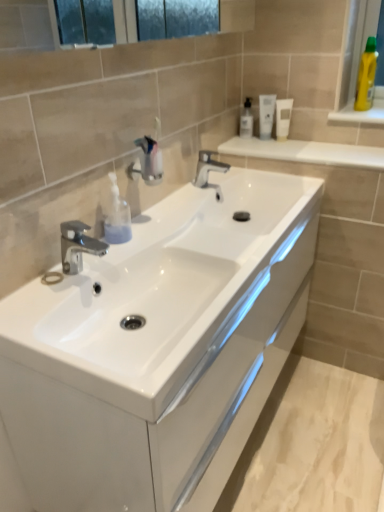
This screenshot has height=512, width=384. Identify the location of vacant space in front of white matte tube at upper center, placed as the 1th mouthwash when sorted from right to left. (293, 149).